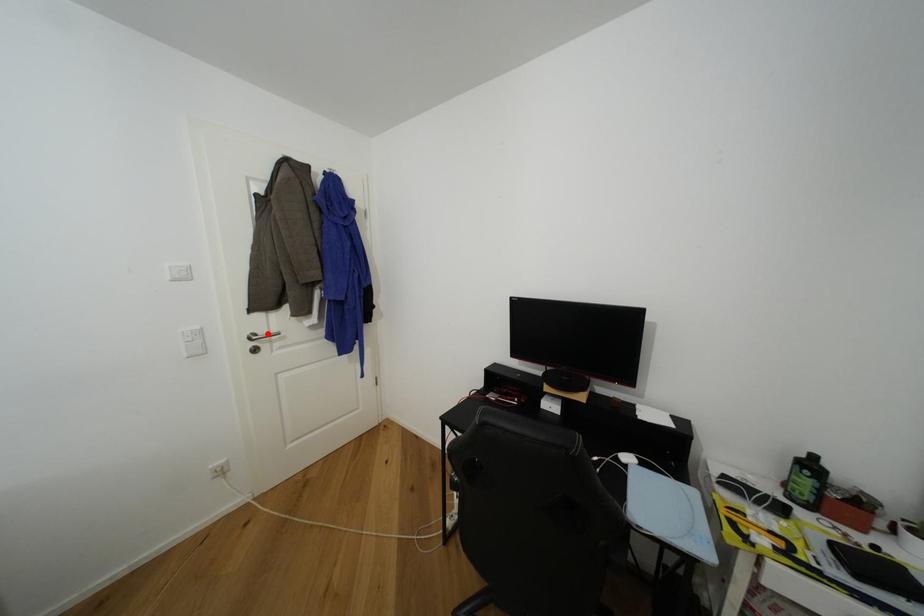
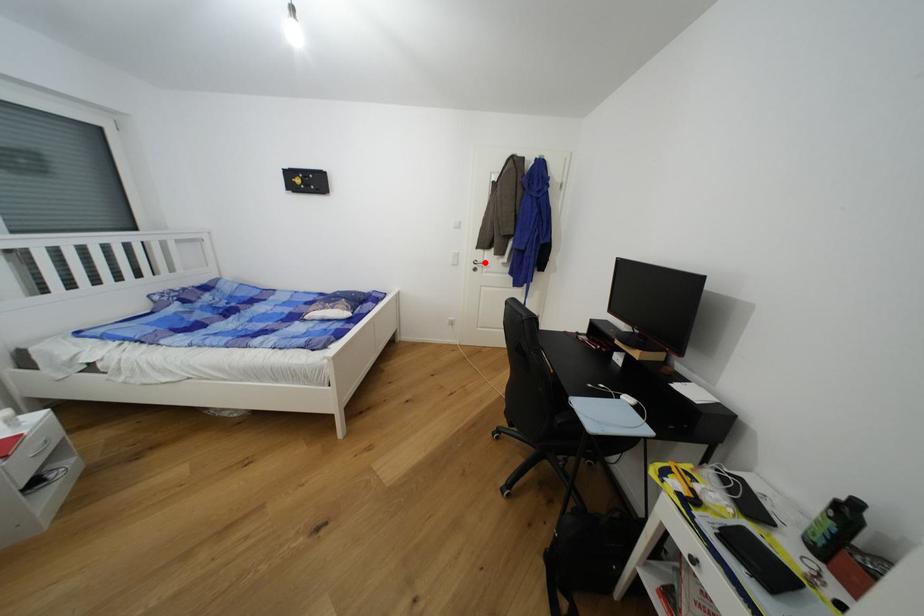
I am providing you with two images of the same scene from different viewpoints. A red point is marked on the first image and another point is marked on the second image. Are the points marked in image1 and image2 representing the same 3D position?

Yes